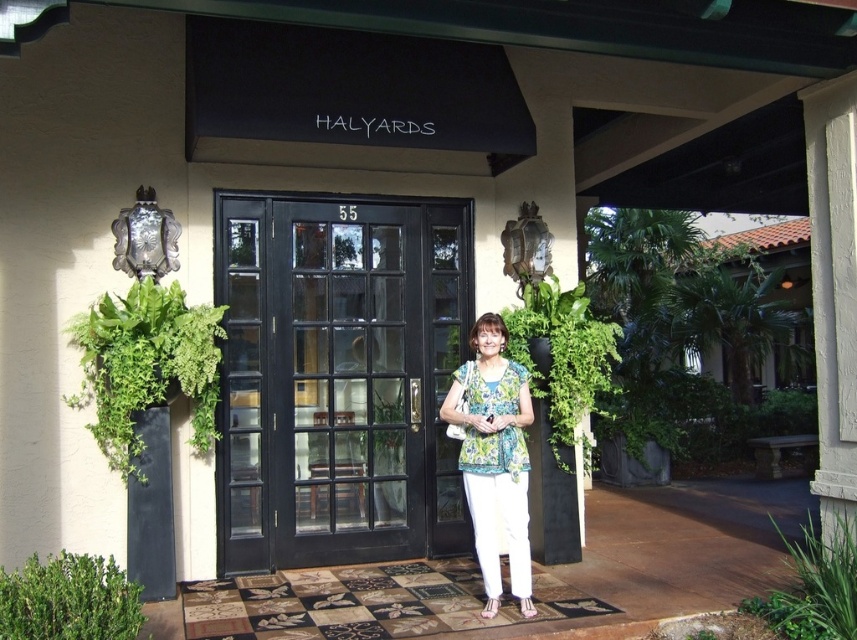
You are a delivery person arriving at the Halyards building entrance. You need to place a large package between the green leafy plant at left and the green leafy bush at lower left. Is there enough space between them to place the package?

The green leafy plant at left is positioned over the green leafy bush at lower left, meaning they are stacked vertically rather than spaced apart horizontally. Therefore, there is no horizontal space between them to place the package.

You are a delivery person trying to enter the building through the entrance shown. You have a large package that requires you to carry it through the black glass door at center. However, you notice the green leafy plant at lower right nearby. Is the door accessible for you to pass through without moving the plant?

The black glass door at center is above the green leafy plant at lower right, meaning the plant is positioned below the door. Since the plant is at the lower part and the door is above it, you can access the door without needing to move the plant.

Based on the photo, you are a delivery person arriving at the Halyards building entrance. You need to place a package between the green leafy plant at left and the green leafy bush at lower left. Which one should you position the package closer to to ensure it is placed between them?

The green leafy plant at left is taller than the green leafy bush at lower left. To place the package between them, position it closer to the green leafy bush at lower left since it is shorter and the package will fit better between the two plants.